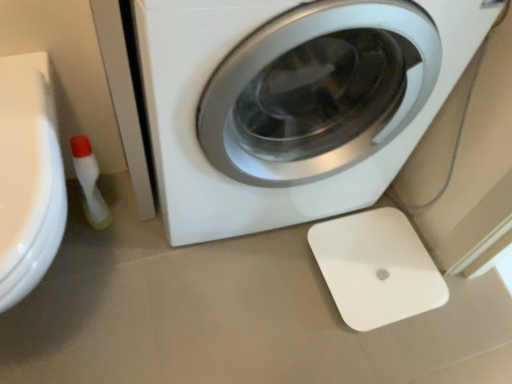
Question: Which is correct: white glossy washing machine at center is inside translucent plastic bottle at lower left, or outside of it?

Choices:
 (A) inside
 (B) outside

Answer: (B)

Question: In terms of width, does white glossy washing machine at center look wider or thinner when compared to translucent plastic bottle at lower left?

Choices:
 (A) thin
 (B) wide

Answer: (B)

Question: Which of these objects is positioned closest to the white plastic scale at lower right?

Choices:
 (A) translucent plastic bottle at lower left
 (B) white glossy washing machine at center

Answer: (B)

Question: Considering the real-world distances, which object is farthest from the translucent plastic bottle at lower left?

Choices:
 (A) white plastic scale at lower right
 (B) white glossy washing machine at center

Answer: (A)